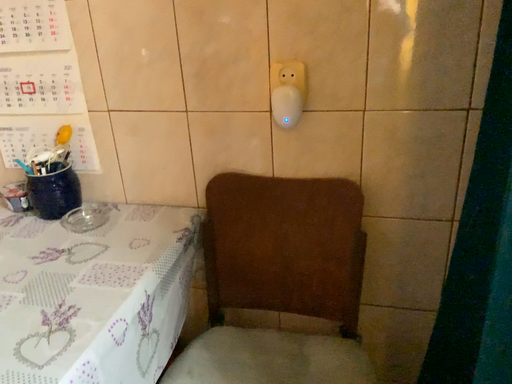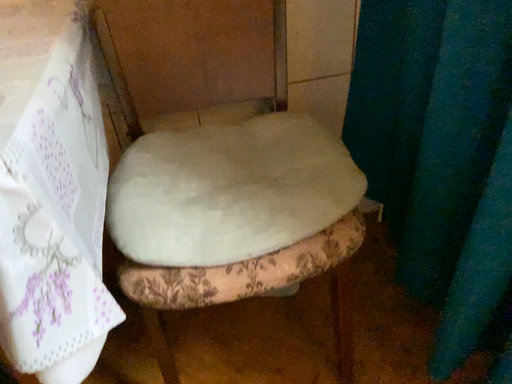
Question: Which way did the camera rotate in the video?

Choices:
 (A) rotated upward
 (B) rotated downward

Answer: (B)